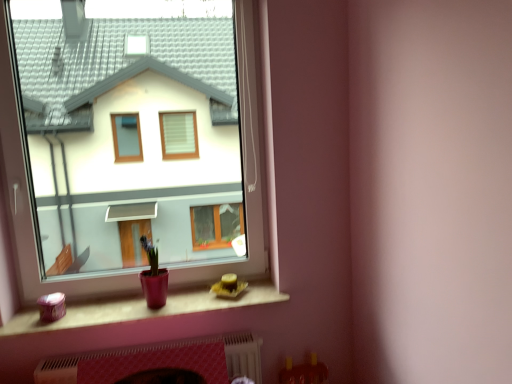
Question: Does matte plastic window sill at lower center turn towards matte glass window at center?

Choices:
 (A) yes
 (B) no

Answer: (B)

Question: Can you confirm if matte plastic window sill at lower center is positioned to the left of matte glass window at center?

Choices:
 (A) yes
 (B) no

Answer: (B)

Question: Considering the relative sizes of matte plastic window sill at lower center and matte glass window at center in the image provided, is matte plastic window sill at lower center thinner than matte glass window at center?

Choices:
 (A) yes
 (B) no

Answer: (B)

Question: Does matte plastic window sill at lower center appear on the right side of matte glass window at center?

Choices:
 (A) yes
 (B) no

Answer: (A)

Question: Is matte plastic window sill at lower center outside matte glass window at center?

Choices:
 (A) yes
 (B) no

Answer: (A)

Question: Considering the relative sizes of matte plastic window sill at lower center and matte glass window at center in the image provided, is matte plastic window sill at lower center smaller than matte glass window at center?

Choices:
 (A) yes
 (B) no

Answer: (A)

Question: Is white textured fireplace at lower center next to matte glass window at center?

Choices:
 (A) yes
 (B) no

Answer: (B)

Question: Considering the relative sizes of white textured fireplace at lower center and matte glass window at center in the image provided, is white textured fireplace at lower center taller than matte glass window at center?

Choices:
 (A) no
 (B) yes

Answer: (A)

Question: Is white textured fireplace at lower center further to the viewer compared to matte glass window at center?

Choices:
 (A) yes
 (B) no

Answer: (A)

Question: Does white textured fireplace at lower center have a lesser width compared to matte glass window at center?

Choices:
 (A) no
 (B) yes

Answer: (A)

Question: Is white textured fireplace at lower center oriented towards matte glass window at center?

Choices:
 (A) no
 (B) yes

Answer: (A)

Question: Considering the relative sizes of white textured fireplace at lower center and matte glass window at center in the image provided, is white textured fireplace at lower center smaller than matte glass window at center?

Choices:
 (A) no
 (B) yes

Answer: (B)

Question: Can we say matte plastic window sill at lower center lies outside white textured fireplace at lower center?

Choices:
 (A) yes
 (B) no

Answer: (A)